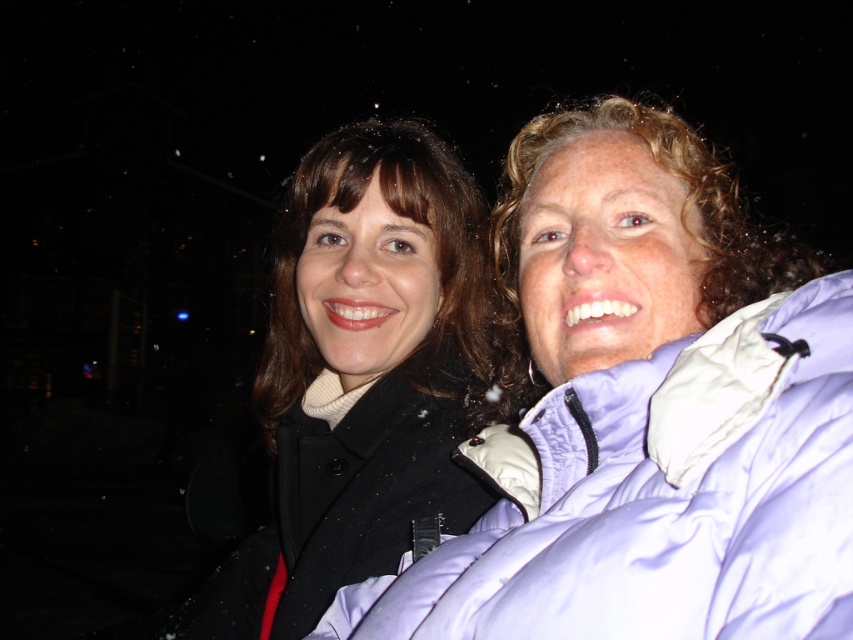
Question: Which point is farther to the camera?

Choices:
 (A) (369, 349)
 (B) (784, 493)

Answer: (A)

Question: Can you confirm if light purple puffy jacket at right is positioned above matte black coat at center?

Choices:
 (A) no
 (B) yes

Answer: (A)

Question: Can you confirm if light purple puffy jacket at right is bigger than matte black coat at center?

Choices:
 (A) yes
 (B) no

Answer: (B)

Question: Among these objects, which one is nearest to the camera?

Choices:
 (A) matte black coat at center
 (B) light purple puffy jacket at right

Answer: (B)

Question: Can you confirm if light purple puffy jacket at right is bigger than matte black coat at center?

Choices:
 (A) no
 (B) yes

Answer: (A)

Question: Which point is farther from the camera taking this photo?

Choices:
 (A) (764, 300)
 (B) (439, 202)

Answer: (B)